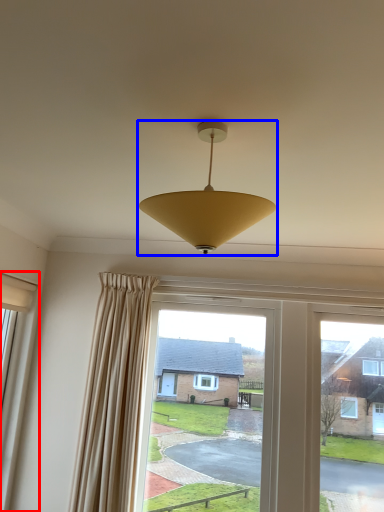
Question: Which of the following is the farthest to the observer, window (highlighted by a red box) or lamp (highlighted by a blue box)?

Choices:
 (A) window
 (B) lamp

Answer: (A)